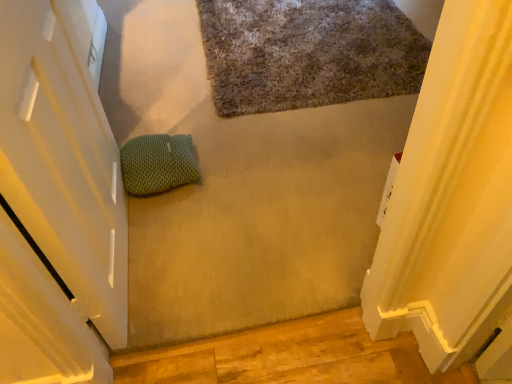
Where is `free space on the front side of green mesh pillow at center`? The width and height of the screenshot is (512, 384). free space on the front side of green mesh pillow at center is located at coordinates (168, 218).